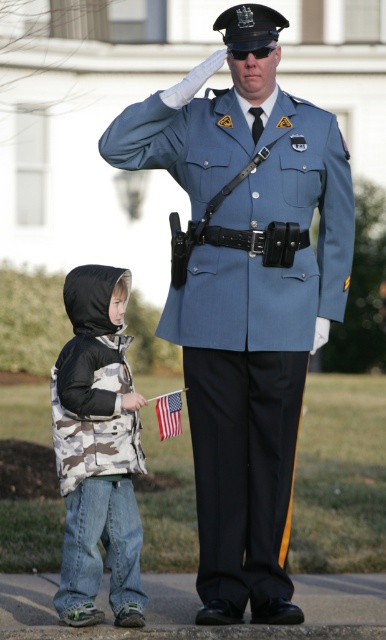
You are a photographer standing at the back of the scene. You need to capture a photo that includes both the camouflage fabric vest at lower left and the american flag at lower center. What is the minimum distance you should maintain between these two objects in your camera frame?

The minimum distance you should maintain between the camouflage fabric vest at lower left and the american flag at lower center in your camera frame is 31.04 inches, as this is the actual distance between them.

You are a photographer at the event and want to ensure both the blue uniform at center and the american flag at lower center are fully visible in the photo. Based on their sizes, do you think they can both fit in the frame if the frame is 1.5 meters wide?

The blue uniform at center might be wider than the american flag at lower center, so if the frame is 1.5 meters wide, it depends on their combined width. However, since the blue uniform at center is possibly wider, there might not be enough space. To ensure both fit, adjust the camera angle or move closer to reduce the distance between them.